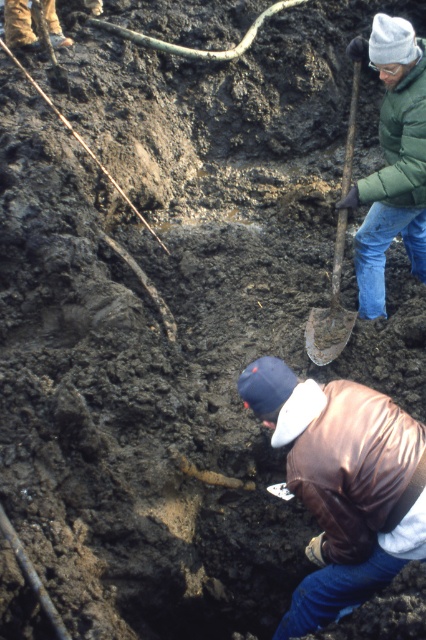
Is brown leather jacket at lower center above green puffy jacket at upper right?

Actually, brown leather jacket at lower center is below green puffy jacket at upper right.

Who is taller, brown leather jacket at lower center or green puffy jacket at upper right?

green puffy jacket at upper right is taller.

You are a GUI agent. You are given a task and a screenshot of the screen. Output one action in this format:
    pyautogui.click(x=<x>, y=<y>)
    Task: Click on the brown leather jacket at lower center
    This screenshot has height=640, width=426.
    Given the screenshot: What is the action you would take?
    pyautogui.click(x=351, y=465)

Can you confirm if green fuzzy jacket at upper right is positioned above rusty metal shovel at upper right?

Yes, green fuzzy jacket at upper right is above rusty metal shovel at upper right.

Between point (391, 148) and point (321, 362), which one is positioned in front?

Point (321, 362) is in front.

Find the location of a particular element. The width and height of the screenshot is (426, 640). green fuzzy jacket at upper right is located at coordinates 400,141.

Can you confirm if brown leather jacket at lower center is positioned to the right of green fuzzy jacket at upper right?

In fact, brown leather jacket at lower center is to the left of green fuzzy jacket at upper right.

Is point (402, 522) closer to camera compared to point (420, 177)?

Yes.

Where is `brown leather jacket at lower center`? This screenshot has height=640, width=426. brown leather jacket at lower center is located at coordinates (351, 465).